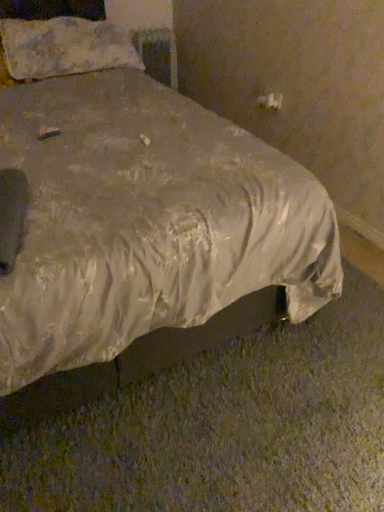
Question: Should I look upward or downward to see silvery satin bed at center?

Choices:
 (A) down
 (B) up

Answer: (B)

Question: Is silvery satin bed at center oriented away from fluffy white pillow at upper left?

Choices:
 (A) yes
 (B) no

Answer: (A)

Question: From a real-world perspective, is silvery satin bed at center physically below fluffy white pillow at upper left?

Choices:
 (A) no
 (B) yes

Answer: (B)

Question: From a real-world perspective, does silvery satin bed at center stand above fluffy white pillow at upper left?

Choices:
 (A) no
 (B) yes

Answer: (A)

Question: Does silvery satin bed at center have a smaller size compared to fluffy white pillow at upper left?

Choices:
 (A) no
 (B) yes

Answer: (A)

Question: Is silvery satin bed at center thinner than fluffy white pillow at upper left?

Choices:
 (A) yes
 (B) no

Answer: (B)

Question: Would you say silvery satin bed at center contains fluffy white pillow at upper left?

Choices:
 (A) yes
 (B) no

Answer: (A)

Question: Is the depth of metallic silver radiator at upper center greater than that of silvery satin bed at center?

Choices:
 (A) yes
 (B) no

Answer: (A)

Question: Considering the relative sizes of metallic silver radiator at upper center and silvery satin bed at center in the image provided, is metallic silver radiator at upper center wider than silvery satin bed at center?

Choices:
 (A) yes
 (B) no

Answer: (B)

Question: Can you confirm if metallic silver radiator at upper center is positioned to the right of silvery satin bed at center?

Choices:
 (A) yes
 (B) no

Answer: (A)

Question: Does metallic silver radiator at upper center have a greater height compared to silvery satin bed at center?

Choices:
 (A) no
 (B) yes

Answer: (A)

Question: Is metallic silver radiator at upper center positioned before silvery satin bed at center?

Choices:
 (A) yes
 (B) no

Answer: (B)

Question: Are metallic silver radiator at upper center and silvery satin bed at center making contact?

Choices:
 (A) no
 (B) yes

Answer: (A)

Question: Considering the relative sizes of fluffy white pillow at upper left and metallic silver radiator at upper center in the image provided, is fluffy white pillow at upper left bigger than metallic silver radiator at upper center?

Choices:
 (A) yes
 (B) no

Answer: (A)